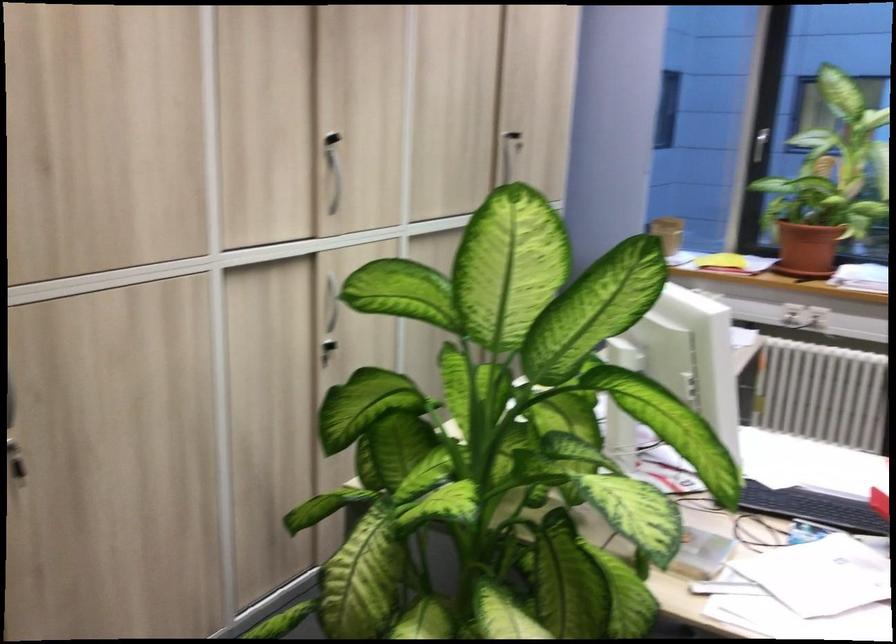
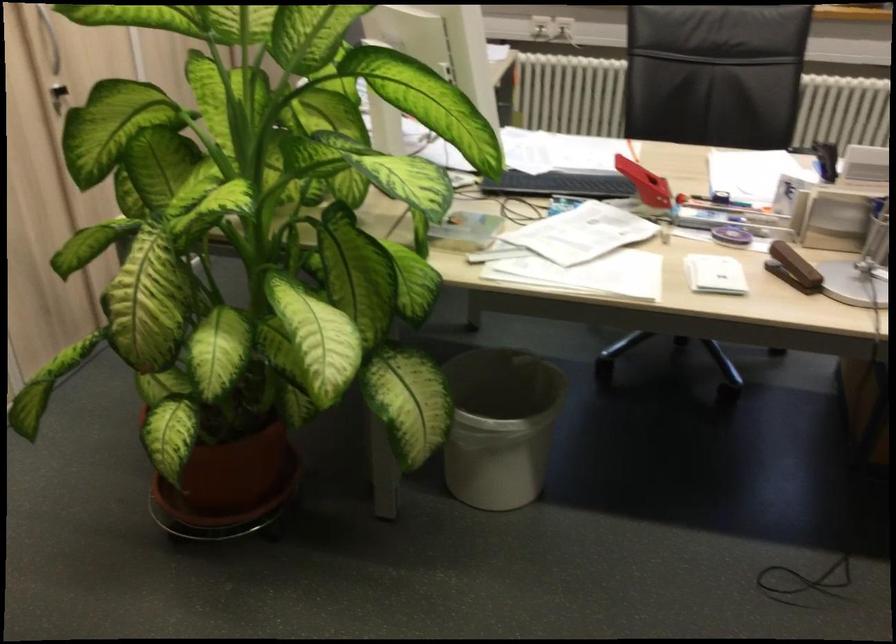
Question: The images are taken continuously from a first-person perspective. In which direction is your viewpoint rotating?

Choices:
 (A) Left
 (B) Right
 (C) Up
 (D) Down

Answer: (D)